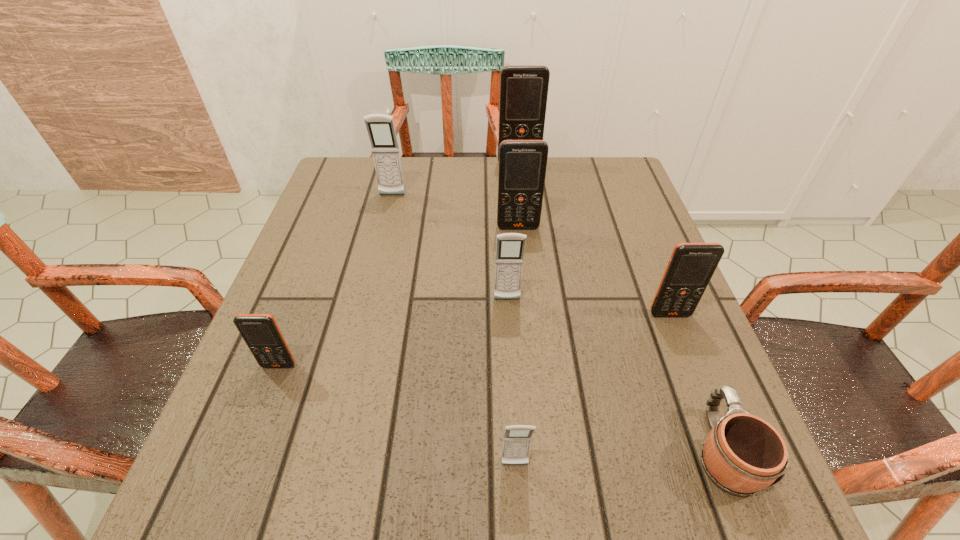
Where is `the tallest object`? the tallest object is located at coordinates point(523,88).

I want to click on the tallest cellular telephone, so click(523, 88).

Identify the location of the second object from left to right. This screenshot has height=540, width=960. (380, 127).

This screenshot has height=540, width=960. What are the coordinates of `the leftmost gray cellular telephone` in the screenshot? It's located at click(x=380, y=127).

Find the location of `the second farthest orange cellular telephone`. the second farthest orange cellular telephone is located at coordinates (522, 163).

At what (x,y) coordinates should I click in order to perform the action: click on the third smallest orange cellular telephone. Please return your answer as a coordinate pair (x, y). Looking at the image, I should click on (522, 163).

Image resolution: width=960 pixels, height=540 pixels. I want to click on the fourth farthest cellular telephone, so click(x=510, y=247).

At what (x,y) coordinates should I click in order to perform the action: click on the fifth nearest object. Please return your answer as a coordinate pair (x, y). Looking at the image, I should click on (510, 247).

You are a GUI agent. You are given a task and a screenshot of the screen. Output one action in this format:
    pyautogui.click(x=<x>, y=<y>)
    Task: Click on the second nearest orange cellular telephone
    
    Given the screenshot: What is the action you would take?
    pyautogui.click(x=691, y=266)

Locate an element on the screen. Image resolution: width=960 pixels, height=540 pixels. the fifth farthest cellular telephone is located at coordinates (691, 266).